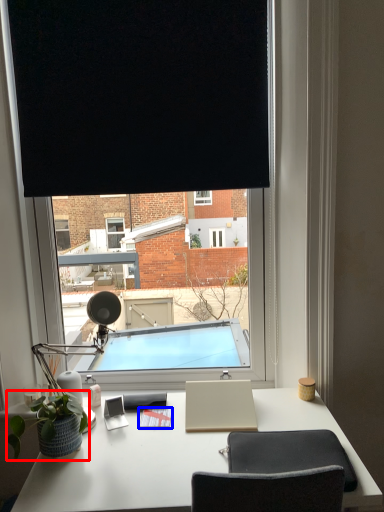
Question: Which object is closer to the camera taking this photo, houseplant (highlighted by a red box) or notepad (highlighted by a blue box)?

Choices:
 (A) houseplant
 (B) notepad

Answer: (A)